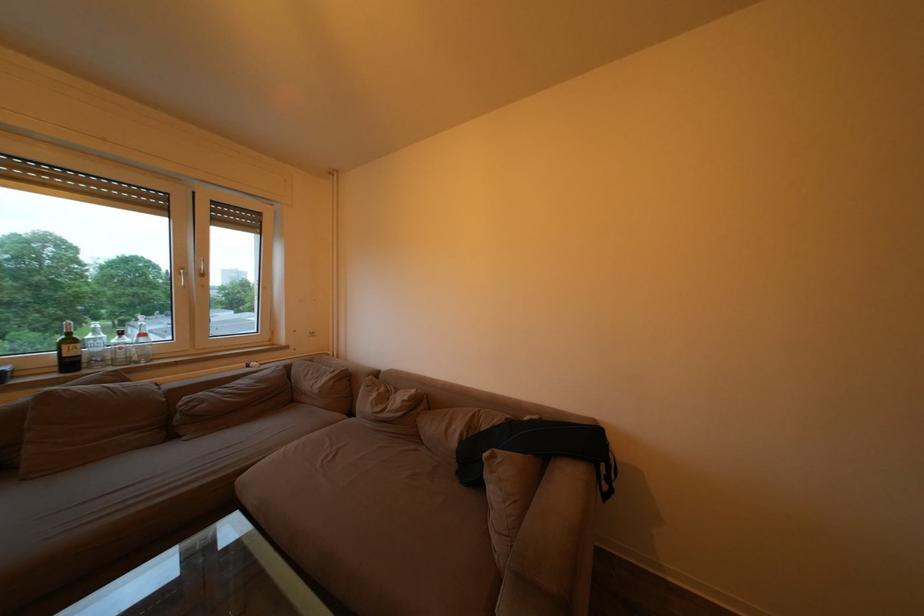
The width and height of the screenshot is (924, 616). I want to click on clear glass bottle, so click(94, 346).